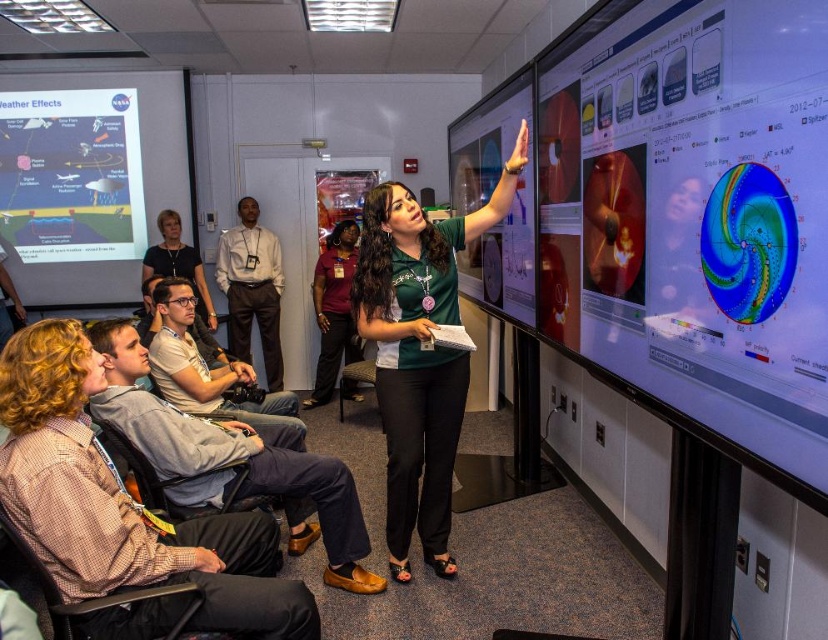
Is green matte shirt at center positioned behind matte white paper at upper left?

No.

Can you confirm if green matte shirt at center is shorter than matte white paper at upper left?

Incorrect, green matte shirt at center's height does not fall short of matte white paper at upper left's.

I want to click on green matte shirt at center, so pyautogui.click(x=419, y=352).

Is shiny metallic screen at upper right above matte plastic screen at upper right?

Result: No, shiny metallic screen at upper right is not above matte plastic screen at upper right.

Which is more to the right, shiny metallic screen at upper right or matte plastic screen at upper right?

From the viewer's perspective, shiny metallic screen at upper right appears more on the right side.

Is point (699, 156) farther from camera compared to point (461, 116)?

No, (699, 156) is closer to viewer.

Locate an element on the screen. The height and width of the screenshot is (640, 828). shiny metallic screen at upper right is located at coordinates (696, 212).

You are a GUI agent. You are given a task and a screenshot of the screen. Output one action in this format:
    pyautogui.click(x=<x>, y=<y>)
    Task: Click on the shiny metallic screen at upper right
    
    Given the screenshot: What is the action you would take?
    pyautogui.click(x=696, y=212)

Is shiny metallic screen at upper right wider than matte white paper at upper left?

Incorrect, shiny metallic screen at upper right's width does not surpass matte white paper at upper left's.

Who is more distant from viewer, [710,164] or [36,90]?

Point [36,90]

This screenshot has width=828, height=640. Find the location of `shiny metallic screen at upper right`. shiny metallic screen at upper right is located at coordinates (696, 212).